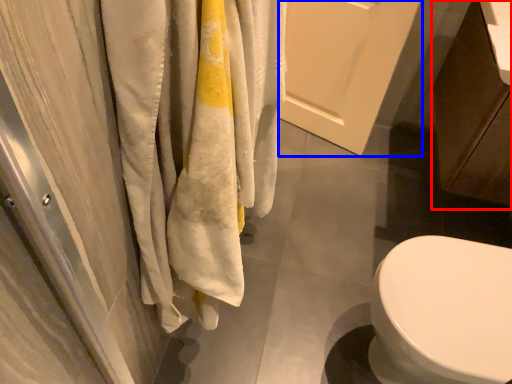
Question: Which point is closer to the camera, cabinetry (highlighted by a red box) or screen door (highlighted by a blue box)?

Choices:
 (A) cabinetry
 (B) screen door

Answer: (A)